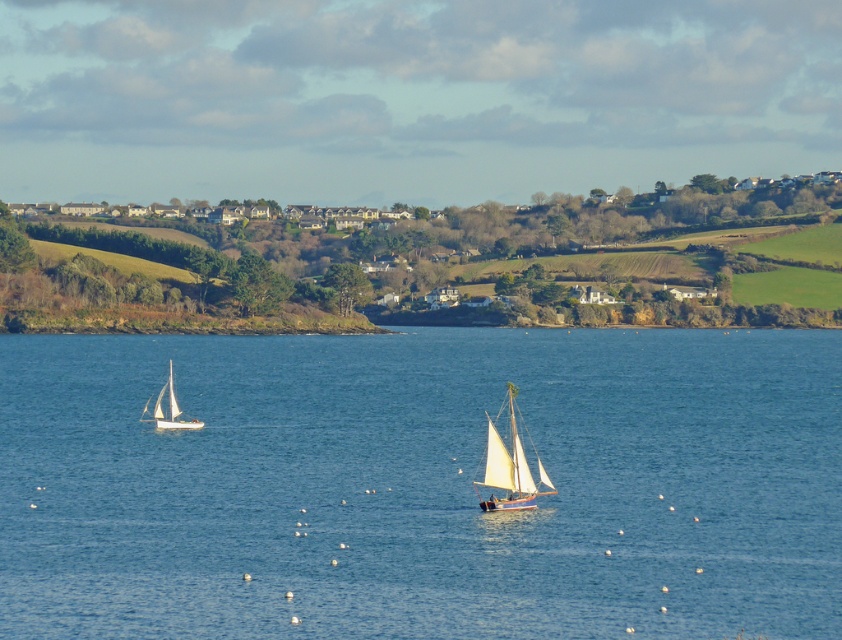
Is blue water at center to the left of wooden sailboat at center from the viewer's perspective?

Yes, blue water at center is to the left of wooden sailboat at center.

The width and height of the screenshot is (842, 640). What do you see at coordinates (421, 484) in the screenshot?
I see `blue water at center` at bounding box center [421, 484].

Is point (464, 556) in front of point (493, 468)?

Yes, it is.

Where is `blue water at center`? This screenshot has height=640, width=842. blue water at center is located at coordinates (421, 484).

Who is positioned more to the right, wooden sailboat at center or white matte sailboat at lower left?

Positioned to the right is wooden sailboat at center.

Who is lower down, wooden sailboat at center or white matte sailboat at lower left?

wooden sailboat at center

Who is more forward, [507,484] or [152,419]?

Point [507,484] is in front.

Where is `wooden sailboat at center`? This screenshot has width=842, height=640. wooden sailboat at center is located at coordinates (510, 468).

Does blue water at center have a lesser width compared to white matte sailboat at lower left?

In fact, blue water at center might be wider than white matte sailboat at lower left.

Is blue water at center further to the viewer compared to white matte sailboat at lower left?

No, blue water at center is in front of white matte sailboat at lower left.

Describe the element at coordinates (421, 484) in the screenshot. I see `blue water at center` at that location.

Image resolution: width=842 pixels, height=640 pixels. Find the location of `blue water at center`. blue water at center is located at coordinates (421, 484).